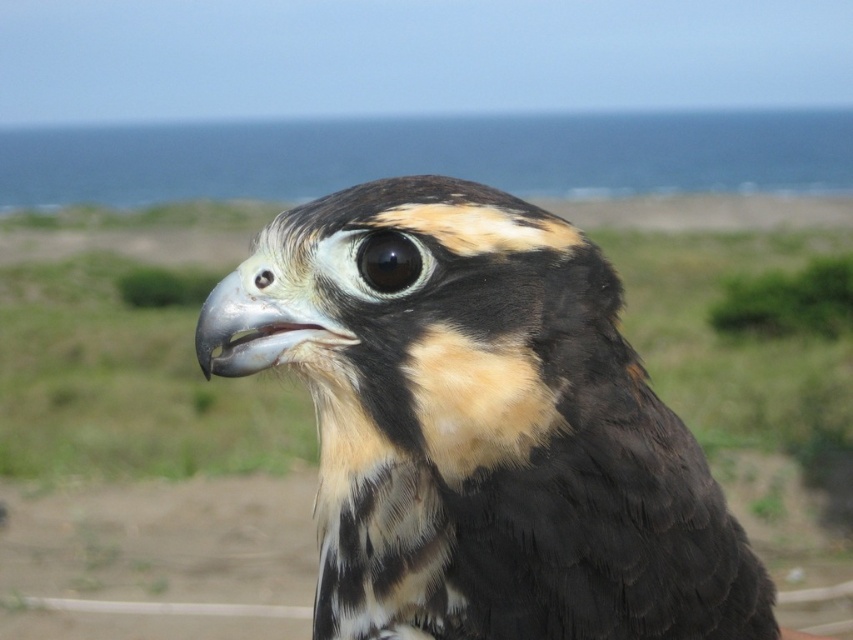
You are a photographer trying to capture the bird in the image. You notice two points marked on the bird. Which point, point [625,573] or point [405,240], is closer to your camera lens?

Point [625,573] is closer to the camera lens than point [405,240].

You are a wildlife photographer aiming to capture a closeup of the black glossy eye at center and the black glossy eye at upper center in the image. The camera you are using has a focus range of 2.5 inches. Can you focus on both eyes simultaneously?

The black glossy eye at center and black glossy eye at upper center are 3.02 inches apart from each other. Since the camera has a focus range of 2.5 inches, it cannot focus on both eyes at the same time because the distance between them exceeds the camera focus range.

You are a wildlife photographer aiming to capture a detailed shot of the black feathered eagle at center and the black glossy eye at center. Given that your camera can only focus on one object at a time, which object should you prioritize focusing on to ensure the subject is in sharp focus, considering their relative sizes?

The black feathered eagle at center is taller than the black glossy eye at center, so focusing on the black feathered eagle at center would ensure it is in sharp focus as it is larger and more likely to be the primary subject.